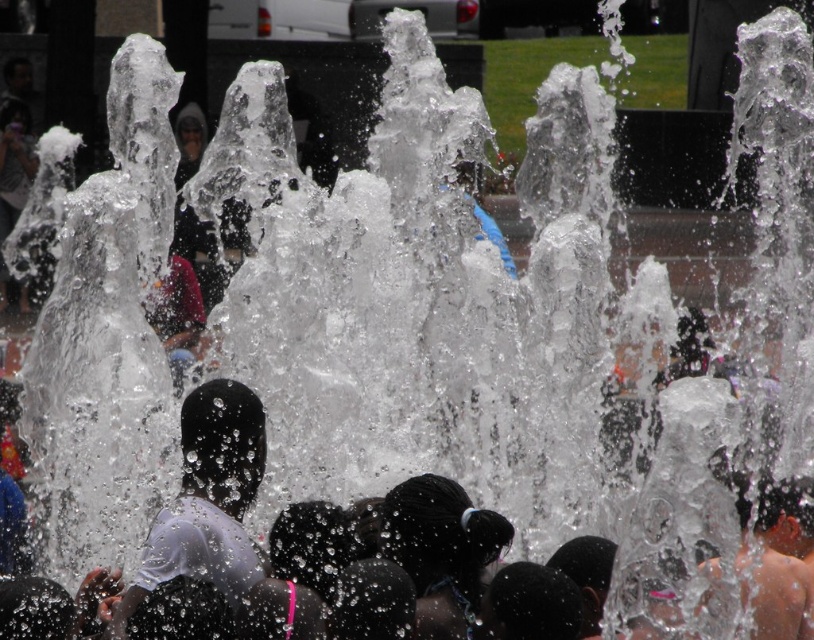
You are a photographer standing at the edge of the fountain. You want to capture a photo where the transparent wet hair at center and the white matte shirt at center are both visible. Which object should you focus on to ensure the other is still in the frame?

The transparent wet hair at center has a greater height compared to the white matte shirt at center. To ensure both are visible in the frame, focus on the transparent wet hair at center since it is taller and will occupy more of the vertical space, allowing the shorter white matte shirt at center to remain in view.

Based on the scene description, where is the transparent wet hair at center located in terms of its 2D coordinates?

The transparent wet hair at center is located at the 2D coordinates point (198, 554).